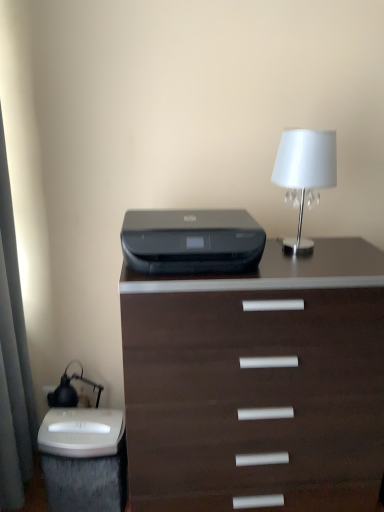
Question: Is dark wood chest of drawers at center taller than black plastic printer at center?

Choices:
 (A) no
 (B) yes

Answer: (B)

Question: From a real-world perspective, is dark wood chest of drawers at center located beneath black plastic printer at center?

Choices:
 (A) yes
 (B) no

Answer: (A)

Question: Is dark wood chest of drawers at center placed right next to black plastic printer at center?

Choices:
 (A) no
 (B) yes

Answer: (A)

Question: Considering the relative positions of dark wood chest of drawers at center and black plastic printer at center in the image provided, is dark wood chest of drawers at center to the right of black plastic printer at center from the viewer's perspective?

Choices:
 (A) no
 (B) yes

Answer: (B)

Question: Is dark wood chest of drawers at center wider than black plastic printer at center?

Choices:
 (A) yes
 (B) no

Answer: (A)

Question: Does dark wood chest of drawers at center have a lesser height compared to black plastic printer at center?

Choices:
 (A) no
 (B) yes

Answer: (A)

Question: Is the depth of white glossy lampshade at upper right greater than that of white plastic electric outlet at lower left?

Choices:
 (A) no
 (B) yes

Answer: (A)

Question: Is white glossy lampshade at upper right aimed at white plastic electric outlet at lower left?

Choices:
 (A) yes
 (B) no

Answer: (B)

Question: Considering the relative sizes of white glossy lampshade at upper right and white plastic electric outlet at lower left in the image provided, is white glossy lampshade at upper right taller than white plastic electric outlet at lower left?

Choices:
 (A) yes
 (B) no

Answer: (A)

Question: Is white glossy lampshade at upper right thinner than white plastic electric outlet at lower left?

Choices:
 (A) yes
 (B) no

Answer: (B)

Question: From the image's perspective, does white glossy lampshade at upper right appear lower than white plastic electric outlet at lower left?

Choices:
 (A) no
 (B) yes

Answer: (A)

Question: Can you confirm if white glossy lampshade at upper right is positioned to the right of white plastic electric outlet at lower left?

Choices:
 (A) no
 (B) yes

Answer: (B)

Question: Considering the relative sizes of white plastic electric outlet at lower left and dark wood chest of drawers at center in the image provided, is white plastic electric outlet at lower left bigger than dark wood chest of drawers at center?

Choices:
 (A) no
 (B) yes

Answer: (A)